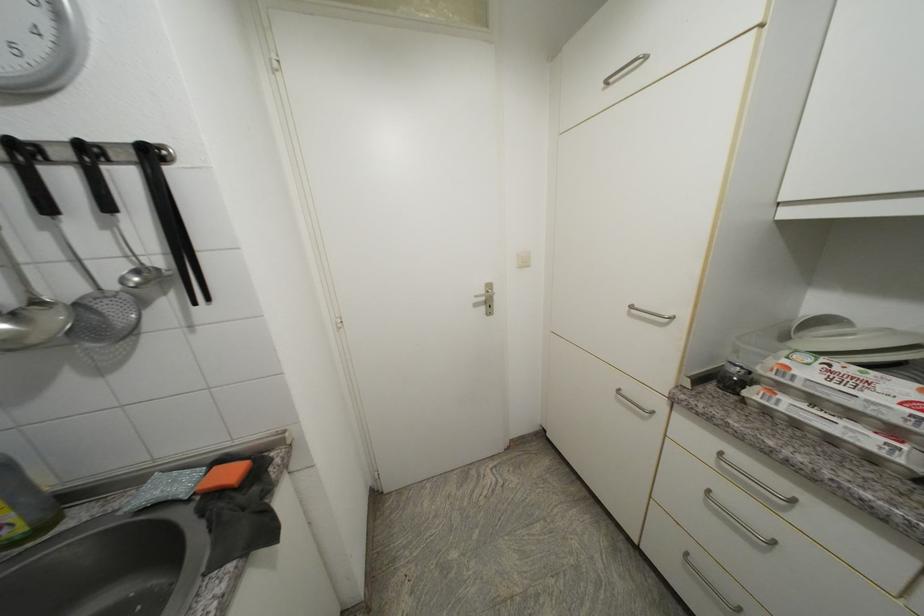
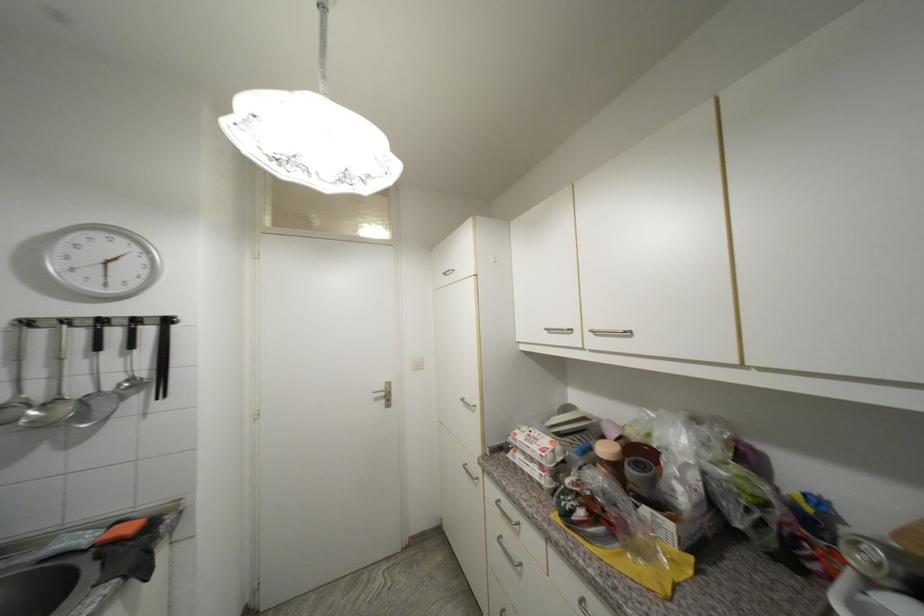
What movement of the cameraman would produce the second image?

A: The movement direction of the cameraman is right, backward.